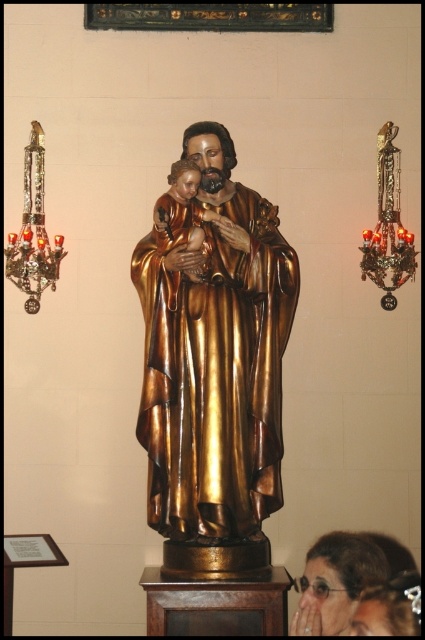
Does gold polished wood statue at center appear over matte gold statue at center?

Yes.

Is gold polished wood statue at center positioned behind matte gold statue at center?

No, gold polished wood statue at center is closer to the viewer.

Is point (175, 499) more distant than point (342, 620)?

No, it is not.

Find the location of `gold polished wood statue at center`. gold polished wood statue at center is located at coordinates (212, 362).